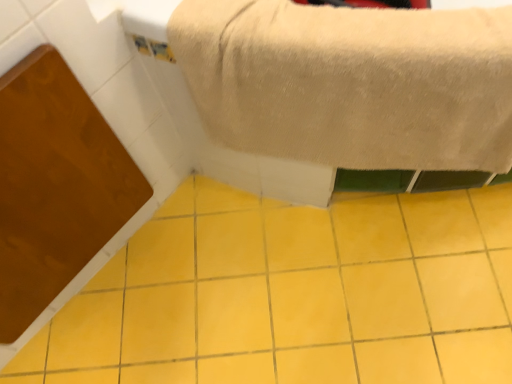
Question: Based on their sizes in the image, would you say beige plush towel at upper center is bigger or smaller than yellow ceramic tile at center?

Choices:
 (A) small
 (B) big

Answer: (B)

Question: From the image's perspective, is beige plush towel at upper center located above or below yellow ceramic tile at center?

Choices:
 (A) above
 (B) below

Answer: (A)

Question: Is beige plush towel at upper center situated inside yellow ceramic tile at center or outside?

Choices:
 (A) outside
 (B) inside

Answer: (A)

Question: Is yellow ceramic tile at center to the left or to the right of beige plush towel at upper center in the image?

Choices:
 (A) right
 (B) left

Answer: (B)

Question: Considering the positions of yellow ceramic tile at center and beige plush towel at upper center in the image, is yellow ceramic tile at center bigger or smaller than beige plush towel at upper center?

Choices:
 (A) big
 (B) small

Answer: (B)

Question: In the image, is yellow ceramic tile at center positioned in front of or behind beige plush towel at upper center?

Choices:
 (A) behind
 (B) front

Answer: (A)

Question: In terms of width, does yellow ceramic tile at center look wider or thinner when compared to beige plush towel at upper center?

Choices:
 (A) wide
 (B) thin

Answer: (A)